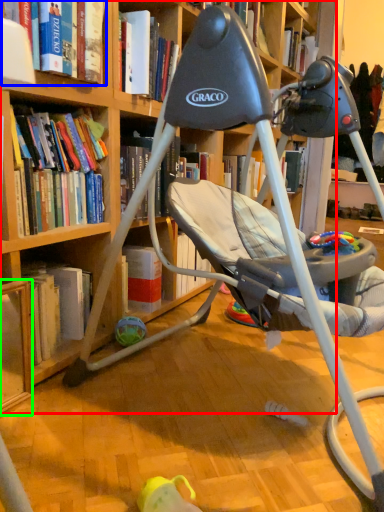
Question: Which object is the farthest from bookcase (highlighted by a red box)? Choose among these: book (highlighted by a blue box) or shelf (highlighted by a green box).

Choices:
 (A) book
 (B) shelf

Answer: (A)